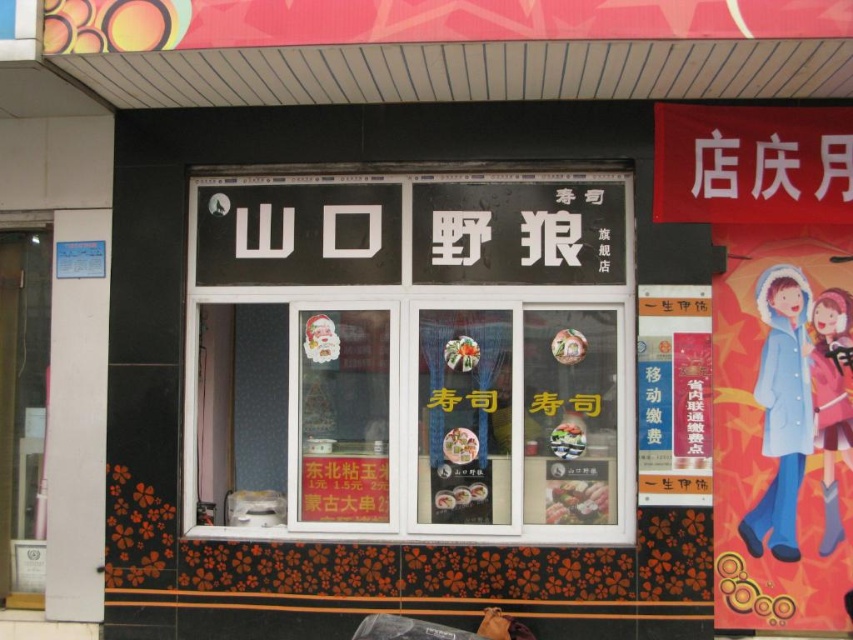
You are standing in front of the Japanese restaurant storefront. You see the black glass shop window at center and the blue fabric coat at right. Which object is higher up?

The black glass shop window at center is above the blue fabric coat at right, so it is higher up.

You are a delivery person who needs to place a large box in front of the black glass shop window at center and the pastel pink fabric at right. Which object can accommodate the box without blocking the window display?

The black glass shop window at center has a larger size compared to pastel pink fabric at right, so placing the large box in front of the black glass shop window at center would be more appropriate as it can accommodate the box without blocking the window display.

You are a customer entering the Japanese restaurant and see the blue fabric coat at right and the pastel pink fabric at right near the entrance. Which fabric is bigger in size?

The blue fabric coat at right is larger in size compared to the pastel pink fabric at right.